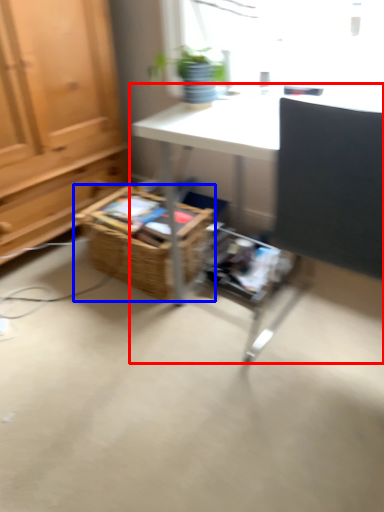
Question: Which point is closer to the camera, desk (highlighted by a red box) or basket (highlighted by a blue box)?

Choices:
 (A) desk
 (B) basket

Answer: (A)